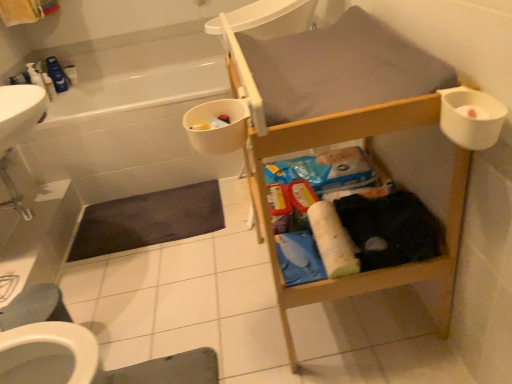
The height and width of the screenshot is (384, 512). I want to click on vacant area that lies to the right of gray fabric bath mat at lower center, placed as the second bath mat when sorted from back to front, so click(x=247, y=339).